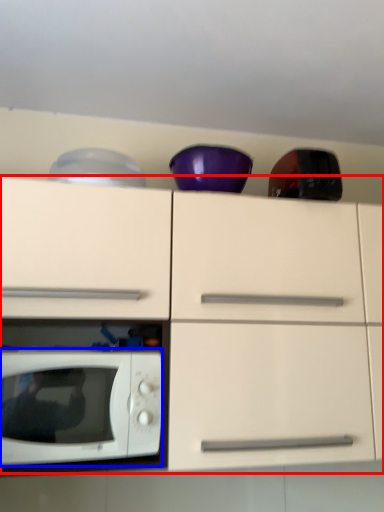
Question: Which object appears farthest to the camera in this image, cabinetry (highlighted by a red box) or microwave oven (highlighted by a blue box)?

Choices:
 (A) cabinetry
 (B) microwave oven

Answer: (B)